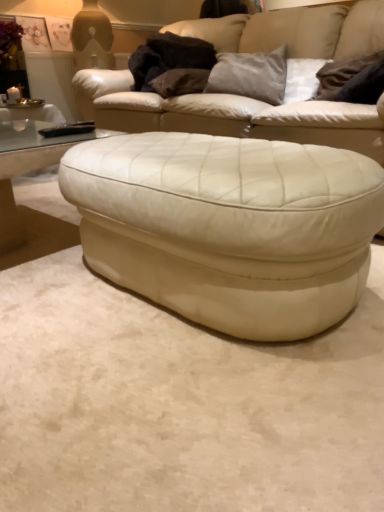
Find the location of a particular element. Image resolution: width=384 pixels, height=512 pixels. velvety dark brown pillow at upper right, positioned as the 3th pillow in left-to-right order is located at coordinates (352, 80).

You are a GUI agent. You are given a task and a screenshot of the screen. Output one action in this format:
    pyautogui.click(x=<x>, y=<y>)
    Task: Click on the transparent glass coffee table at lower left
    This screenshot has width=384, height=512.
    Given the screenshot: What is the action you would take?
    pyautogui.click(x=27, y=167)

What do you see at coordinates (229, 227) in the screenshot?
I see `white leather ottoman at center` at bounding box center [229, 227].

Locate an element on the screen. The width and height of the screenshot is (384, 512). white leather ottoman at center is located at coordinates (229, 227).

Describe the element at coordinates (251, 75) in the screenshot. I see `suede gray pillow at upper center, arranged as the 2th pillow when viewed from the right` at that location.

This screenshot has width=384, height=512. I want to click on velvety dark brown pillow at upper right, positioned as the 3th pillow in left-to-right order, so click(x=352, y=80).

Consider the image. From the image's perspective, does transparent glass coffee table at lower left appear lower than white leather studio couch at center?

Indeed, from the image's perspective, transparent glass coffee table at lower left is shown beneath white leather studio couch at center.

The height and width of the screenshot is (512, 384). I want to click on studio couch positioned vertically above the transparent glass coffee table at lower left (from a real-world perspective), so click(x=229, y=115).

Is transparent glass coffee table at lower left situated inside white leather studio couch at center or outside?

transparent glass coffee table at lower left exists outside the volume of white leather studio couch at center.

Is transparent glass coffee table at lower left wider or thinner than white leather studio couch at center?

In the image, transparent glass coffee table at lower left appears to be more narrow than white leather studio couch at center.

Looking at their sizes, would you say suede gray pillow at upper center, arranged as the 2th pillow when viewed from the right, is wider or thinner than white leather studio couch at center?

Considering their sizes, suede gray pillow at upper center, arranged as the 2th pillow when viewed from the right, looks slimmer than white leather studio couch at center.

How distant is suede gray pillow at upper center, arranged as the 2th pillow when viewed from the right, from white leather studio couch at center?

A distance of 11.93 inches exists between suede gray pillow at upper center, arranged as the 2th pillow when viewed from the right, and white leather studio couch at center.

What's the angular difference between suede gray pillow at upper center, positioned as the second pillow in left-to-right order, and white leather studio couch at center's facing directions?

The facing directions of suede gray pillow at upper center, positioned as the second pillow in left-to-right order, and white leather studio couch at center are 26.3 degrees apart.

Identify the location of studio couch on the left side of suede gray pillow at upper center, positioned as the second pillow in left-to-right order. (229, 115).

Which object is more forward, velvet brown pillow at upper center, the third pillow from the right, or white leather ottoman at center?

white leather ottoman at center is in front.

In the scene shown: Which of these two, velvet brown pillow at upper center, the third pillow from the right, or white leather ottoman at center, is wider?

Wider between the two is white leather ottoman at center.

Is velvet brown pillow at upper center, which is counted as the first pillow, starting from the left, smaller than white leather ottoman at center?

Yes.

Do you think velvet brown pillow at upper center, which is counted as the first pillow, starting from the left, is within white leather ottoman at center, or outside of it?

The correct answer is: outside.

Is velvet brown pillow at upper center, the third pillow from the right, next to black leather remote at left and touching it?

No, velvet brown pillow at upper center, the third pillow from the right, is not with black leather remote at left.

Visually, is velvet brown pillow at upper center, the third pillow from the right, positioned to the left or to the right of black leather remote at left?

Based on their positions, velvet brown pillow at upper center, the third pillow from the right, is located to the right of black leather remote at left.

Can you confirm if velvet brown pillow at upper center, which is counted as the first pillow, starting from the left, is bigger than black leather remote at left?

Indeed, velvet brown pillow at upper center, which is counted as the first pillow, starting from the left, has a larger size compared to black leather remote at left.

From the image's perspective, between velvet brown pillow at upper center, which is counted as the first pillow, starting from the left, and black leather remote at left, who is located below?

black leather remote at left is shown below in the image.

Who is smaller, transparent glass coffee table at lower left or velvety dark brown pillow at upper right, positioned as the 3th pillow in left-to-right order?

With smaller size is velvety dark brown pillow at upper right, positioned as the 3th pillow in left-to-right order.

Find the location of a particular element. Image resolution: width=384 pixels, height=512 pixels. coffee table on the left of velvety dark brown pillow at upper right, acting as the first pillow starting from the right is located at coordinates (27, 167).

Would you say transparent glass coffee table at lower left is a long distance from velvety dark brown pillow at upper right, positioned as the 3th pillow in left-to-right order?

Absolutely, transparent glass coffee table at lower left is distant from velvety dark brown pillow at upper right, positioned as the 3th pillow in left-to-right order.

Considering the positions of objects transparent glass coffee table at lower left and velvety dark brown pillow at upper right, acting as the first pillow starting from the right, in the image provided, who is more to the right, transparent glass coffee table at lower left or velvety dark brown pillow at upper right, acting as the first pillow starting from the right,?

velvety dark brown pillow at upper right, acting as the first pillow starting from the right, is more to the right.

Considering the relative positions of white leather studio couch at center and suede gray pillow at upper center, positioned as the second pillow in left-to-right order, in the image provided, is white leather studio couch at center to the left of suede gray pillow at upper center, positioned as the second pillow in left-to-right order, from the viewer's perspective?

Correct, you'll find white leather studio couch at center to the left of suede gray pillow at upper center, positioned as the second pillow in left-to-right order.

From the image's perspective, relative to suede gray pillow at upper center, arranged as the 2th pillow when viewed from the right, is white leather studio couch at center above or below?

white leather studio couch at center is situated lower than suede gray pillow at upper center, arranged as the 2th pillow when viewed from the right, in the image.

From the picture: Would you say white leather studio couch at center is inside or outside suede gray pillow at upper center, positioned as the second pillow in left-to-right order?

white leather studio couch at center exists outside the volume of suede gray pillow at upper center, positioned as the second pillow in left-to-right order.

The image size is (384, 512). Identify the location of pillow that is the 1st object to the right of the white leather studio couch at center, starting at the anchor. (251, 75).

Does black leather remote at left come behind transparent glass coffee table at lower left?

Yes.

From a real-world perspective, is black leather remote at left under transparent glass coffee table at lower left?

No, from a real-world perspective, black leather remote at left is not under transparent glass coffee table at lower left.

In terms of height, does black leather remote at left look taller or shorter compared to transparent glass coffee table at lower left?

black leather remote at left is shorter than transparent glass coffee table at lower left.

This screenshot has height=512, width=384. Find the location of `studio couch that appears on the right of transparent glass coffee table at lower left`. studio couch that appears on the right of transparent glass coffee table at lower left is located at coordinates 229,115.

Identify the location of pillow that is the 2nd object located above the white leather studio couch at center (from the image's perspective). Image resolution: width=384 pixels, height=512 pixels. (251, 75).

When comparing their distances from transparent glass coffee table at lower left, does white leather studio couch at center or white leather ottoman at center seem closer?

Based on the image, white leather ottoman at center appears to be nearer to transparent glass coffee table at lower left.

Which object lies nearer to the anchor point transparent glass coffee table at lower left, velvet brown pillow at upper center, the third pillow from the right, or white leather studio couch at center?

The object closer to transparent glass coffee table at lower left is white leather studio couch at center.

Estimate the real-world distances between objects in this image. Which object is closer to velvet brown pillow at upper center, which is counted as the first pillow, starting from the left, white leather studio couch at center or transparent glass coffee table at lower left?

Based on the image, white leather studio couch at center appears to be nearer to velvet brown pillow at upper center, which is counted as the first pillow, starting from the left.

In the scene shown: From the image, which object appears to be farther from transparent glass coffee table at lower left, velvety dark brown pillow at upper right, acting as the first pillow starting from the right, or white leather ottoman at center?

velvety dark brown pillow at upper right, acting as the first pillow starting from the right, lies further to transparent glass coffee table at lower left than the other object.

In the scene shown: Based on their spatial positions, is velvet brown pillow at upper center, which is counted as the first pillow, starting from the left, or white leather ottoman at center further from white leather studio couch at center?

white leather ottoman at center is further to white leather studio couch at center.

Considering their positions, is white leather studio couch at center positioned closer to black leather remote at left than white leather ottoman at center?

The object closer to black leather remote at left is white leather studio couch at center.

Looking at the image, which one is located further to velvety dark brown pillow at upper right, positioned as the 3th pillow in left-to-right order, black leather remote at left or transparent glass coffee table at lower left?

The object further to velvety dark brown pillow at upper right, positioned as the 3th pillow in left-to-right order, is transparent glass coffee table at lower left.

Which object lies further to the anchor point velvety dark brown pillow at upper right, acting as the first pillow starting from the right, white leather studio couch at center or transparent glass coffee table at lower left?

Based on the image, transparent glass coffee table at lower left appears to be further to velvety dark brown pillow at upper right, acting as the first pillow starting from the right.

The image size is (384, 512). Identify the location of pillow located between black leather remote at left and suede gray pillow at upper center, positioned as the second pillow in left-to-right order, in the left-right direction. (180, 82).

The width and height of the screenshot is (384, 512). Identify the location of studio couch positioned between white leather ottoman at center and black leather remote at left from near to far. (229, 115).

Locate an element on the screen. studio couch situated between transparent glass coffee table at lower left and velvety dark brown pillow at upper right, acting as the first pillow starting from the right, from left to right is located at coordinates (229, 115).

The height and width of the screenshot is (512, 384). In order to click on pad between transparent glass coffee table at lower left and velvety dark brown pillow at upper right, acting as the first pillow starting from the right, from left to right in this screenshot , I will do `click(68, 129)`.